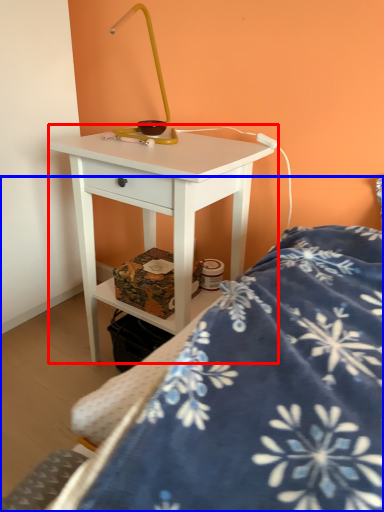
Question: Which point is closer to the camera, nightstand (highlighted by a red box) or bed (highlighted by a blue box)?

Choices:
 (A) nightstand
 (B) bed

Answer: (B)